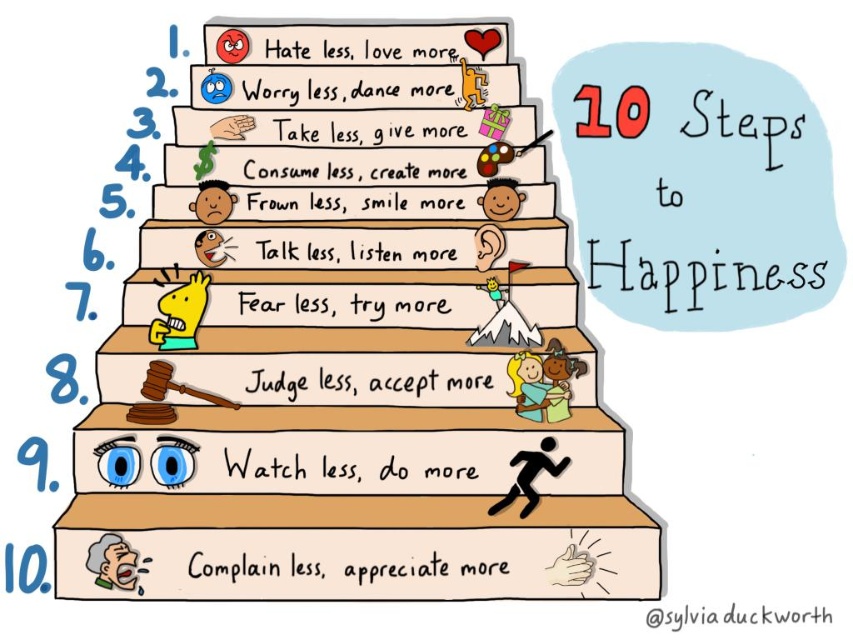
Question: Can you confirm if golden statue at upper center is positioned below smooth skin face at center?

Choices:
 (A) no
 (B) yes

Answer: (B)

Question: Which point is farther to the camera?

Choices:
 (A) smooth skin face at center
 (B) gray paper at bottom
 (C) golden statue at upper center

Answer: (A)

Question: Which object appears closest to the camera in this image?

Choices:
 (A) smooth skin face at center
 (B) golden statue at upper center
 (C) black figure at bottom

Answer: (C)

Question: Is wooden stairs at center above gray paper at bottom?

Choices:
 (A) yes
 (B) no

Answer: (A)

Question: Which point appears closest to the camera in this image?

Choices:
 (A) (519, 356)
 (B) (555, 476)
 (C) (94, 580)

Answer: (C)

Question: Does black figure at bottom have a larger size compared to golden statue at upper center?

Choices:
 (A) no
 (B) yes

Answer: (B)